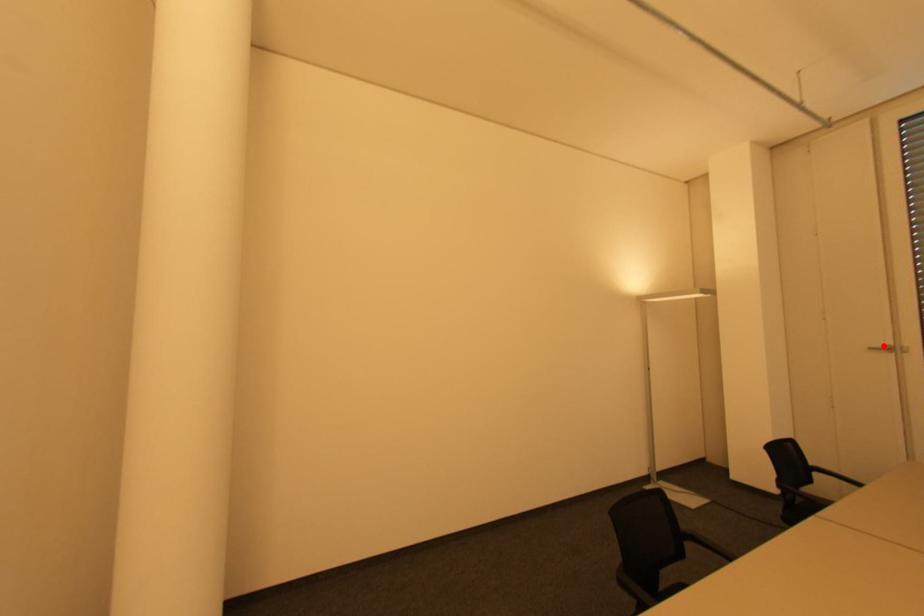
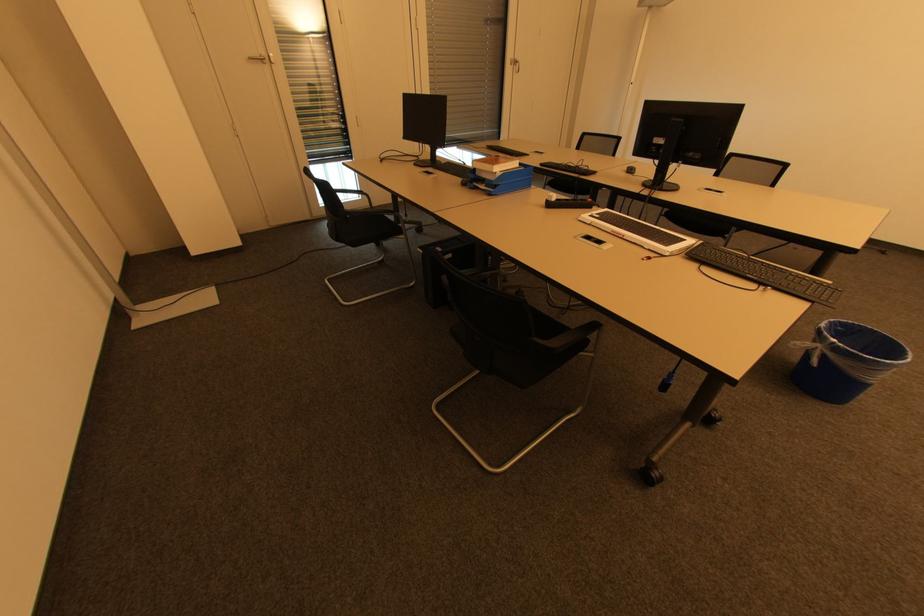
Question: I am providing you with two images of the same scene from different viewpoints. Given a red point in image1, look at the same physical point in image2. Is it:

Choices:
 (A) Closer to the viewpoint
 (B) Farther from the viewpoint

Answer: (B)